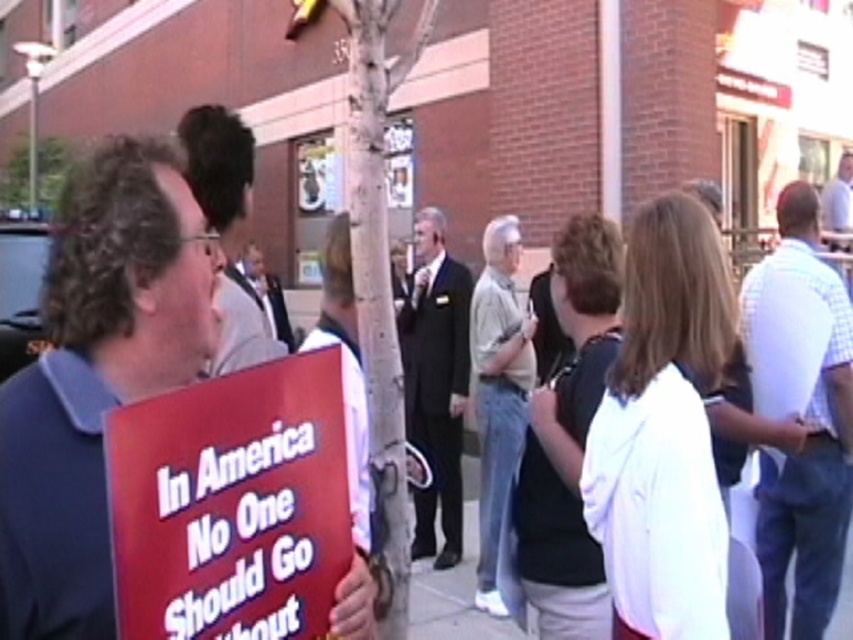
Is dark suit at center wider than light brown denim jeans at lower center?

Yes.

Is dark suit at center closer to the viewer compared to light brown denim jeans at lower center?

No, it is behind light brown denim jeans at lower center.

Who is more distant from viewer, (x=454, y=464) or (x=474, y=332)?

Positioned behind is point (x=454, y=464).

You are a GUI agent. You are given a task and a screenshot of the screen. Output one action in this format:
    pyautogui.click(x=<x>, y=<y>)
    Task: Click on the dark suit at center
    
    Given the screenshot: What is the action you would take?
    pyautogui.click(x=436, y=381)

Who is higher up, red cardboard sign at center or dark suit at center?

Positioned higher is red cardboard sign at center.

Which is below, red cardboard sign at center or dark suit at center?

dark suit at center is below.

Locate an element on the screen. red cardboard sign at center is located at coordinates (231, 504).

This screenshot has height=640, width=853. What do you see at coordinates (231, 504) in the screenshot?
I see `red cardboard sign at center` at bounding box center [231, 504].

Between point (219, 406) and point (764, 268), which one is positioned behind?

Point (764, 268)

What do you see at coordinates (231, 504) in the screenshot? Image resolution: width=853 pixels, height=640 pixels. I see `red cardboard sign at center` at bounding box center [231, 504].

What are the coordinates of `red cardboard sign at center` in the screenshot? It's located at (231, 504).